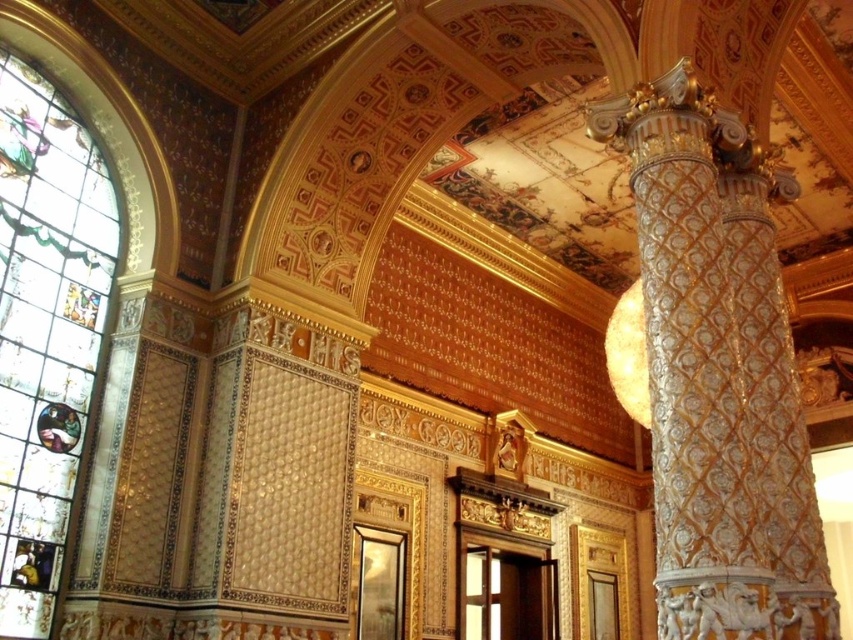
Question: Which object is closer to the camera taking this photo?

Choices:
 (A) stained glass at left
 (B) white textured column at right

Answer: (B)

Question: Can you confirm if white textured column at right is positioned to the right of stained glass at left?

Choices:
 (A) yes
 (B) no

Answer: (A)

Question: Is white textured column at right thinner than stained glass at left?

Choices:
 (A) no
 (B) yes

Answer: (A)

Question: Is white textured column at right to the right of stained glass at left from the viewer's perspective?

Choices:
 (A) no
 (B) yes

Answer: (B)

Question: Which object is farther from the camera taking this photo?

Choices:
 (A) stained glass at left
 (B) white textured column at right

Answer: (A)